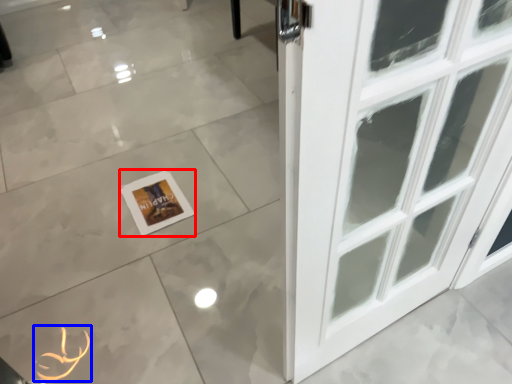
Question: Which of the following is the farthest to the observer, picture frame (highlighted by a red box) or print (highlighted by a blue box)?

Choices:
 (A) picture frame
 (B) print

Answer: (A)